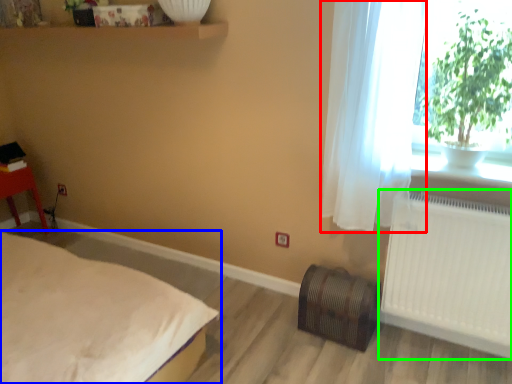
Question: Estimate the real-world distances between objects in this image. Which object is closer to curtain (highlighted by a red box), bed (highlighted by a blue box) or radiator (highlighted by a green box)?

Choices:
 (A) bed
 (B) radiator

Answer: (B)